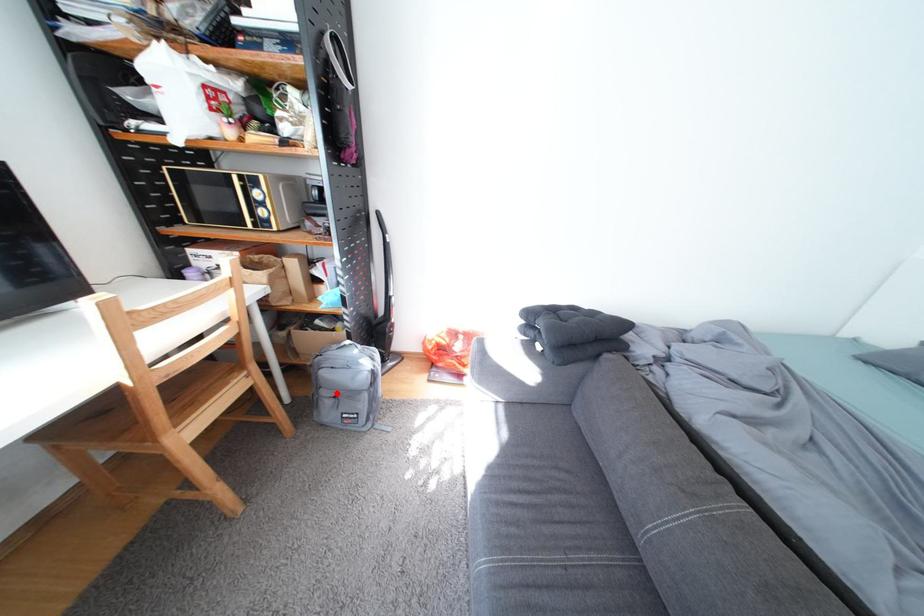
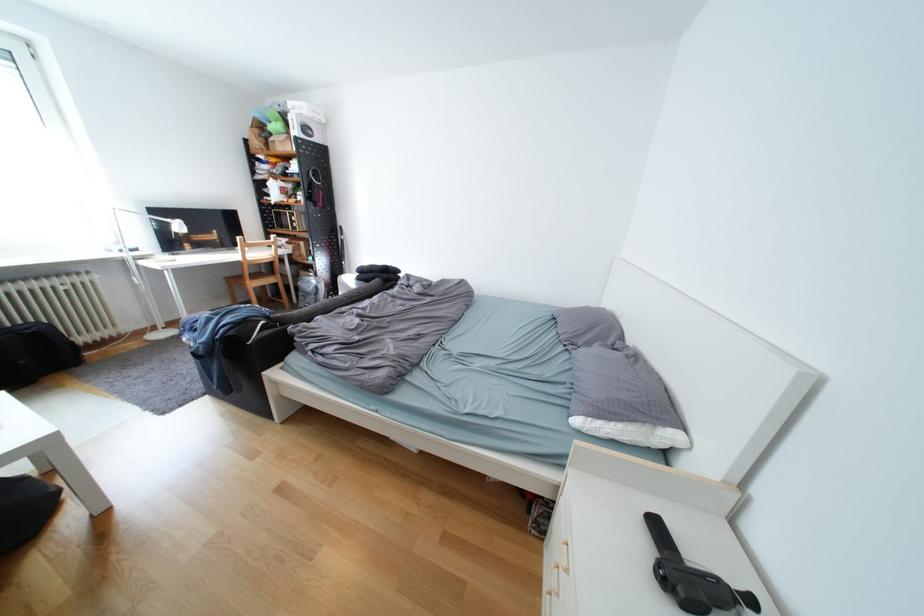
Where in the second image is the point corresponding to the highlighted location from the first image?

(313, 294)